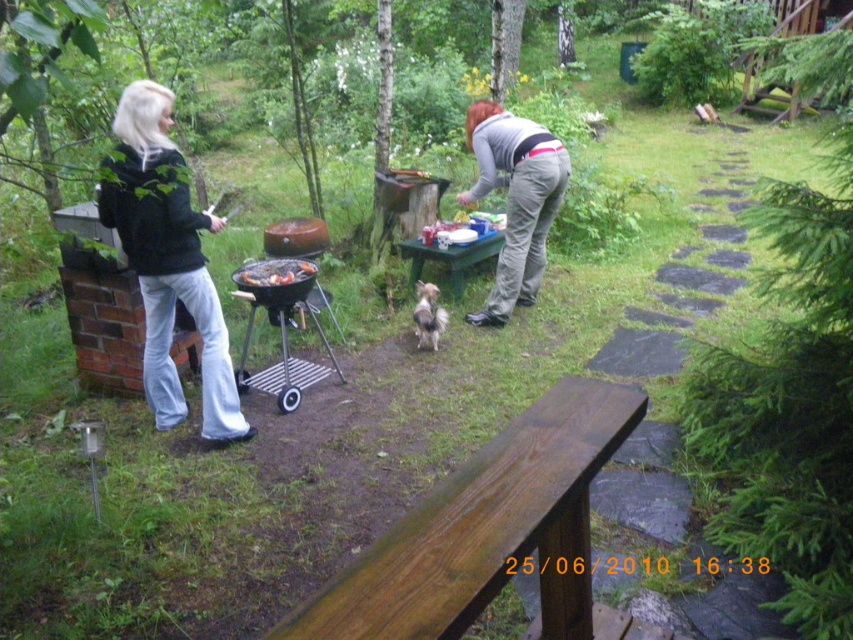
Who is more forward, [538,164] or [312,272]?

Point [312,272] is in front.

Does gray cotton pants at center appear under grilled meat at center?

No.

This screenshot has height=640, width=853. Identify the location of gray cotton pants at center. (515, 198).

Does point (521, 240) lie behind point (430, 344)?

Yes, point (521, 240) is farther from viewer.

Which is more to the right, gray cotton pants at center or fluffy white dog at center?

From the viewer's perspective, gray cotton pants at center appears more on the right side.

Locate an element on the screen. gray cotton pants at center is located at coordinates (515, 198).

Who is taller, black matte jacket at left or fluffy white dog at center?

Standing taller between the two is black matte jacket at left.

Is black matte jacket at left below fluffy white dog at center?

Actually, black matte jacket at left is above fluffy white dog at center.

Who is more forward, (161, 131) or (416, 282)?

Positioned in front is point (161, 131).

Locate an element on the screen. black matte jacket at left is located at coordinates (167, 264).